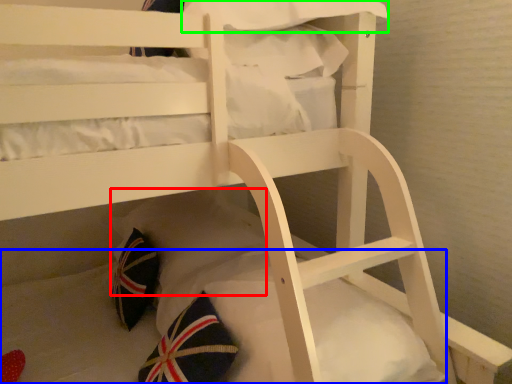
Question: Considering the real-world distances, which object is closest to pillow (highlighted by a red box)? mattress (highlighted by a blue box) or pillow (highlighted by a green box).

Choices:
 (A) mattress
 (B) pillow

Answer: (A)